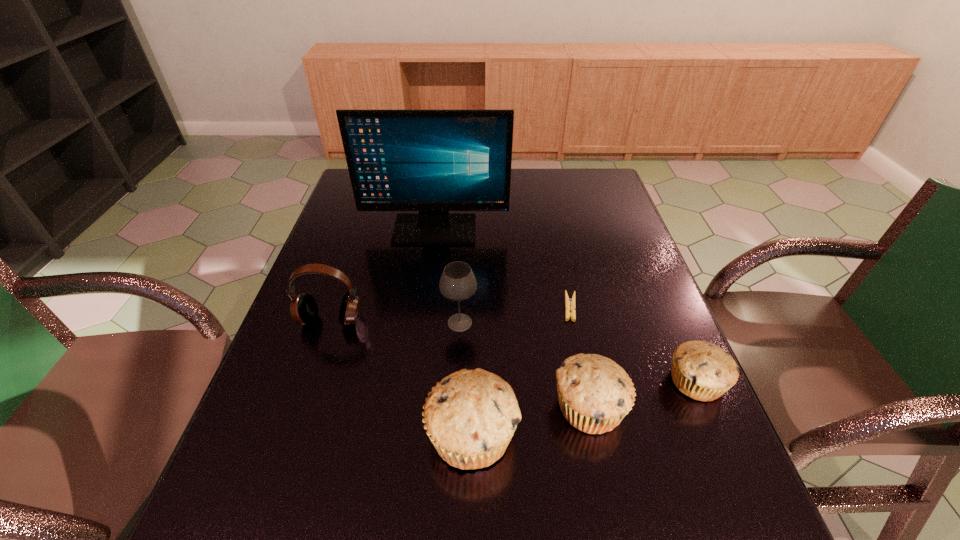
Please show where to add a muffin on the left while keeping spacing even. Please provide its 2D coordinates. Your answer should be formatted as a tuple, i.e. [(x, y)], where the tuple contains the x and y coordinates of a point satisfying the conditions above.

[(341, 465)]